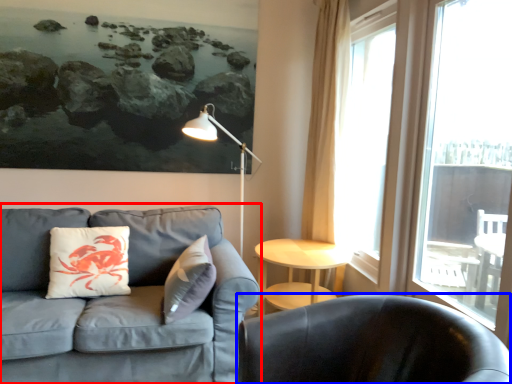
Question: Which of the following is the farthest to the observer, studio couch (highlighted by a red box) or chair (highlighted by a blue box)?

Choices:
 (A) studio couch
 (B) chair

Answer: (A)